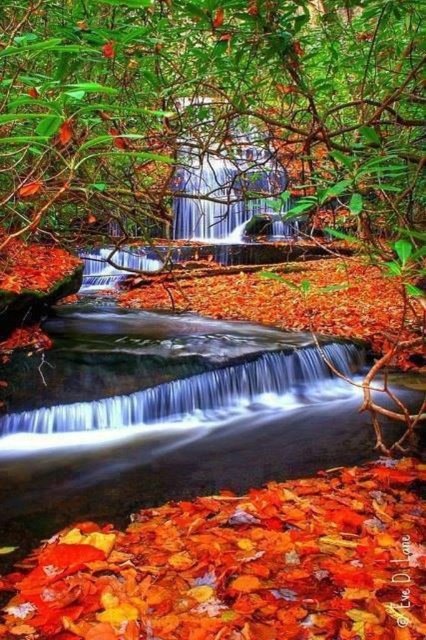
Which is more to the right, shiny red leaves at center or white smooth water at center?

shiny red leaves at center

Can you confirm if shiny red leaves at center is positioned below white smooth water at center?

Yes, shiny red leaves at center is below white smooth water at center.

The height and width of the screenshot is (640, 426). Identify the location of shiny red leaves at center. (238, 564).

Find the location of a particular element. shiny red leaves at center is located at coordinates (238, 564).

Which is more to the right, smooth water at center or white smooth water at center?

From the viewer's perspective, smooth water at center appears more on the right side.

Is smooth water at center behind white smooth water at center?

That is False.

Locate an element on the screen. The image size is (426, 640). smooth water at center is located at coordinates (173, 420).

Is point (242, 508) farther from viewer compared to point (267, 378)?

No.

Does shiny red leaves at center have a smaller size compared to smooth water at center?

Yes, shiny red leaves at center is smaller than smooth water at center.

I want to click on shiny red leaves at center, so click(x=238, y=564).